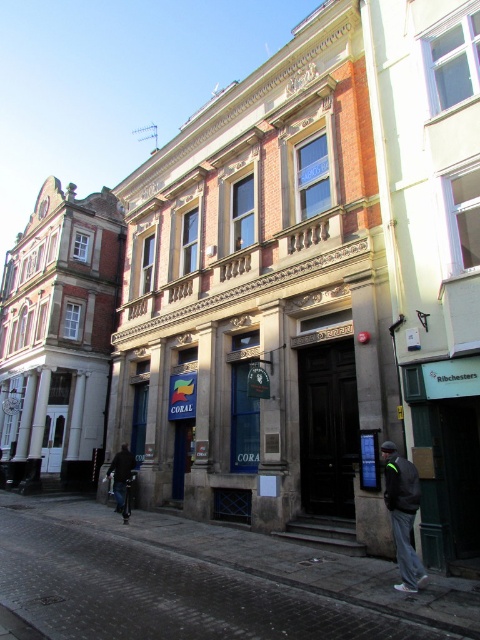
You are a delivery person standing at the center of the street in the image. You need to deliver a package to the dark gray jacket at lower right. Based on the coordinates provided, in which direction should you move from your current position to reach the jacket?

The dark gray jacket at lower right is located at coordinates point (403, 513). Since you are at the center, moving towards the lower right direction will lead you to the jacket.

You are a pedestrian standing on the street in front of the historic buildings. You see a dark gray jacket at lower right and dark blue jeans at lower left. Which item is located higher up?

The dark gray jacket at lower right is positioned over the dark blue jeans at lower left, so it is located higher up.

You are standing on the street looking at the buildings. You notice a person wearing a dark gray jacket at lower right and dark blue jeans at lower left. Which piece of clothing is nearer to you?

The dark gray jacket at lower right is closer to the viewer than the dark blue jeans at lower left.